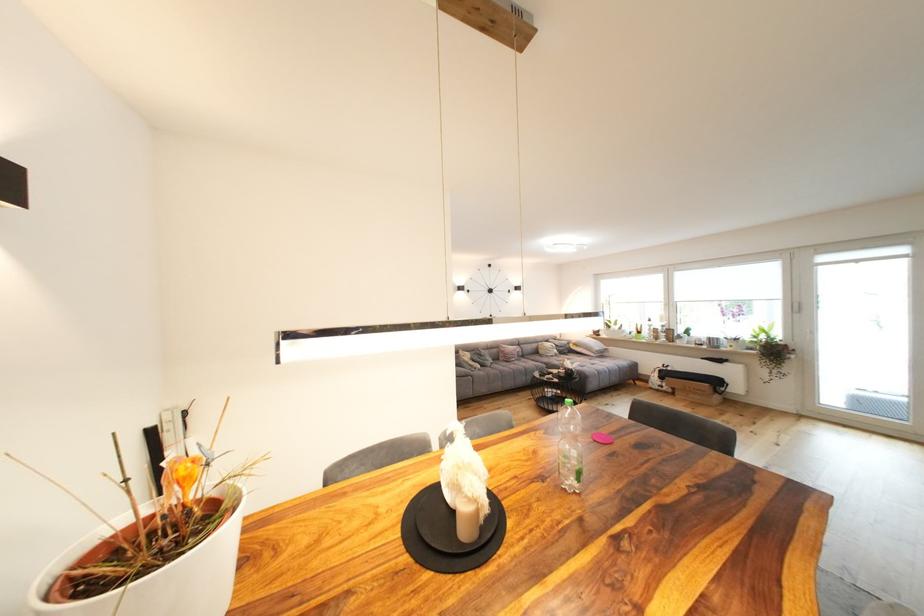
Where is `sofa sitting surface`? The width and height of the screenshot is (924, 616). sofa sitting surface is located at coordinates (521, 366).